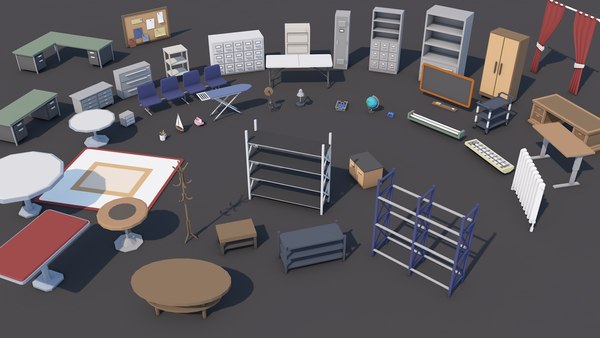
You are a GUI agent. You are given a task and a screenshot of the screen. Output one action in this format:
    pyautogui.click(x=<x>, y=<y>)
    Task: Click on the desks
    
    Given the screenshot: What is the action you would take?
    pyautogui.click(x=567, y=143), pyautogui.click(x=581, y=117), pyautogui.click(x=29, y=105), pyautogui.click(x=76, y=39)